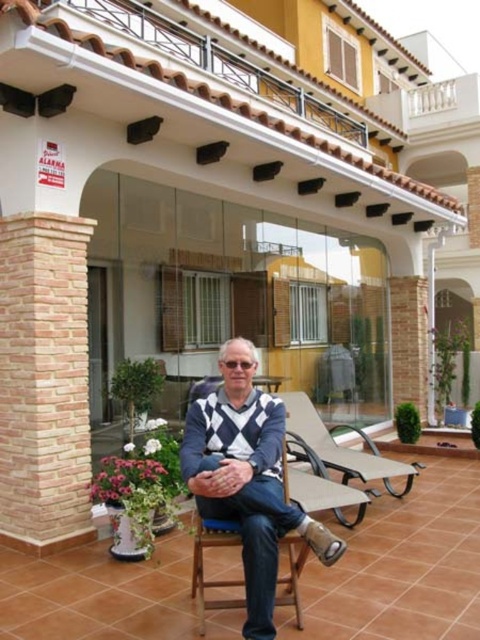
Question: Can you confirm if light brown brick pillar at left is smaller than knitted sweater at center?

Choices:
 (A) no
 (B) yes

Answer: (B)

Question: Does light brown brick pillar at left appear under knitted sweater at center?

Choices:
 (A) no
 (B) yes

Answer: (A)

Question: Which object is closer to the camera taking this photo?

Choices:
 (A) knitted sweater at center
 (B) light brown brick pillar at left

Answer: (A)

Question: Is light brown brick pillar at left to the left of knitted sweater at center from the viewer's perspective?

Choices:
 (A) no
 (B) yes

Answer: (B)

Question: Which point appears closest to the camera in this image?

Choices:
 (A) (21, 221)
 (B) (227, 371)

Answer: (B)